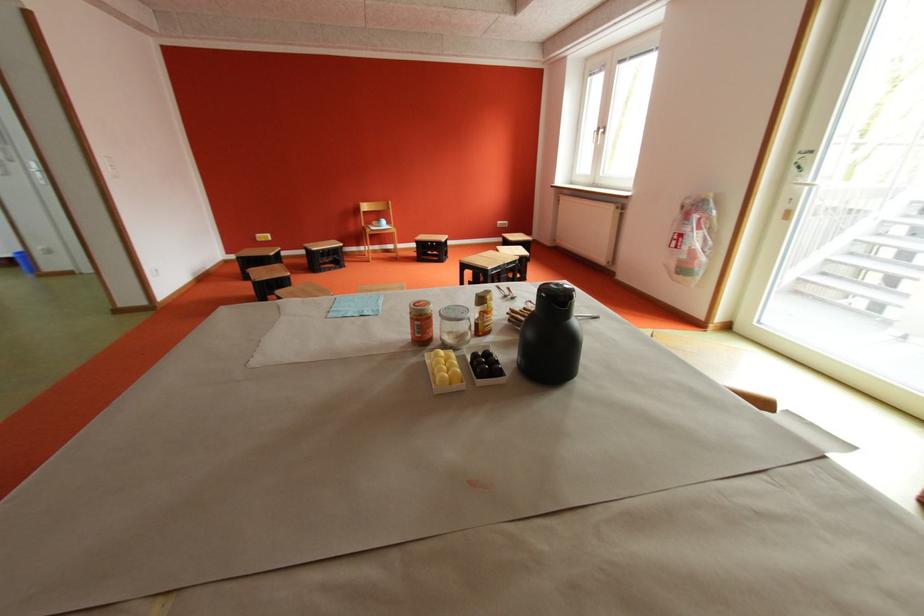
You are a GUI agent. You are given a task and a screenshot of the screen. Output one action in this format:
    pyautogui.click(x=<x>, y=<y>)
    Task: Click on the glass door handle
    
    Given the screenshot: What is the action you would take?
    pyautogui.click(x=599, y=134)